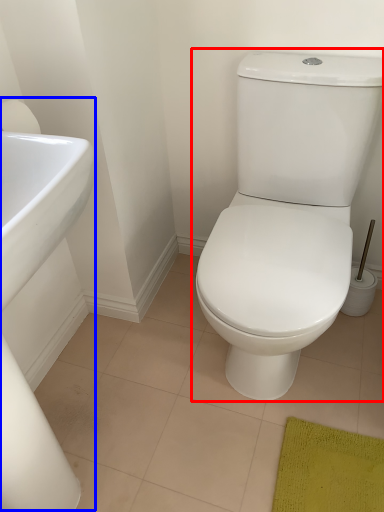
Question: Among these objects, which one is farthest to the camera, toilet (highlighted by a red box) or sink (highlighted by a blue box)?

Choices:
 (A) toilet
 (B) sink

Answer: (A)